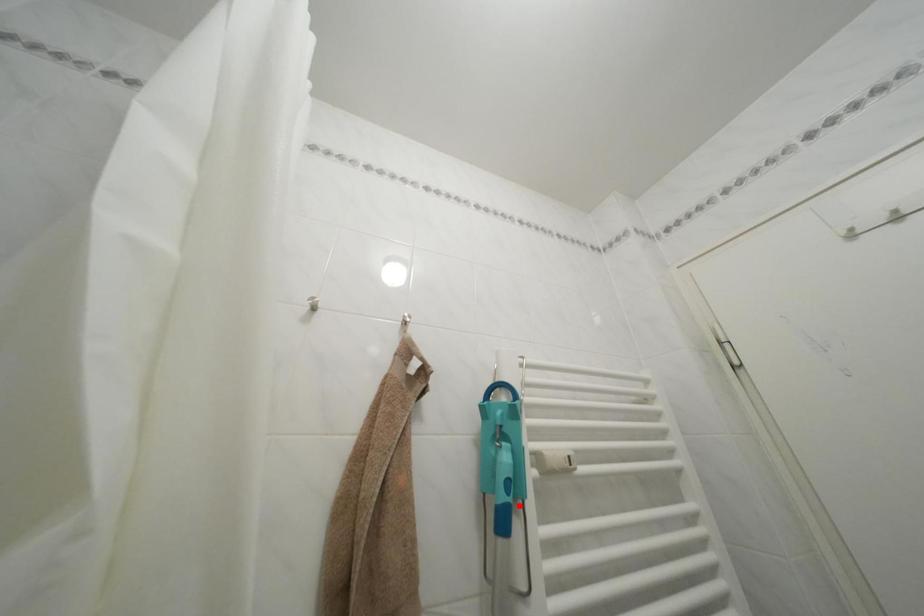
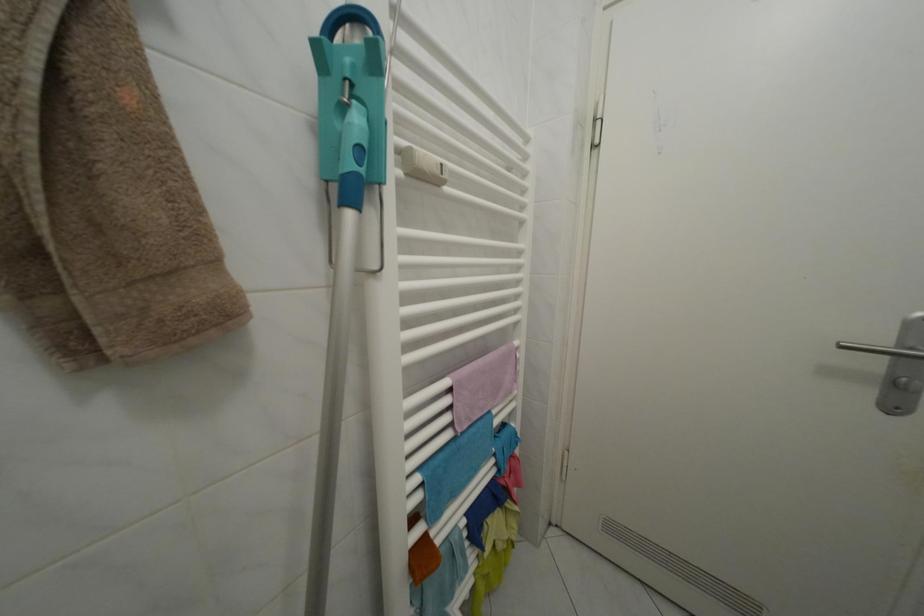
The point at the highlighted location is marked in the first image. Where is the corresponding point in the second image?

(371, 177)